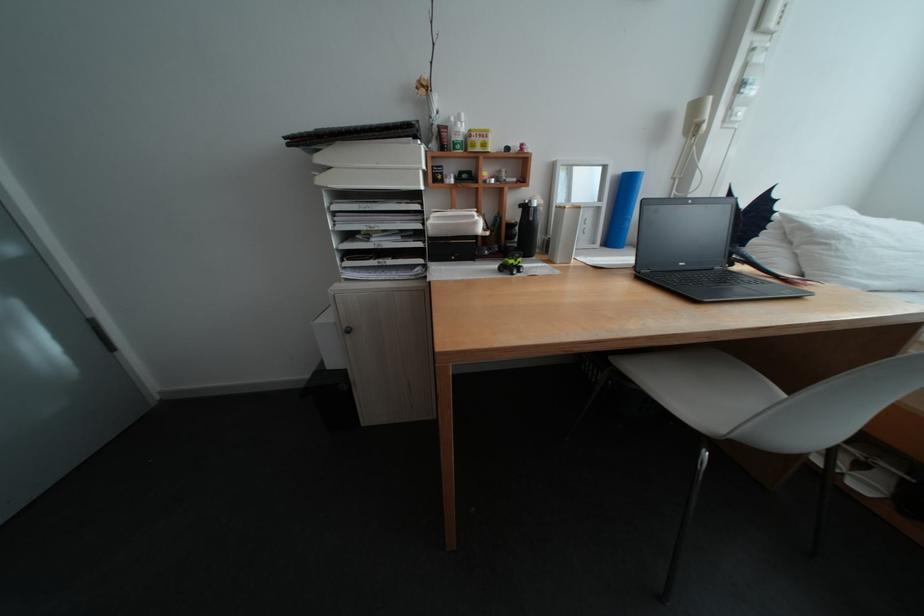
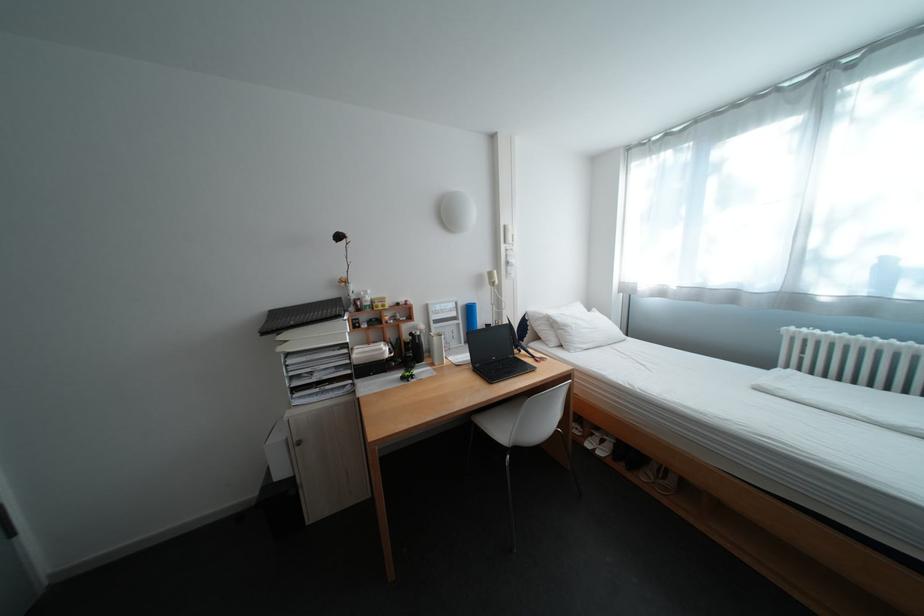
Question: Based on the continuous images, in which direction is the camera rotating? Reply with the corresponding letter.

Choices:
 (A) Left
 (B) Right
 (C) Up
 (D) Down

Answer: (B)